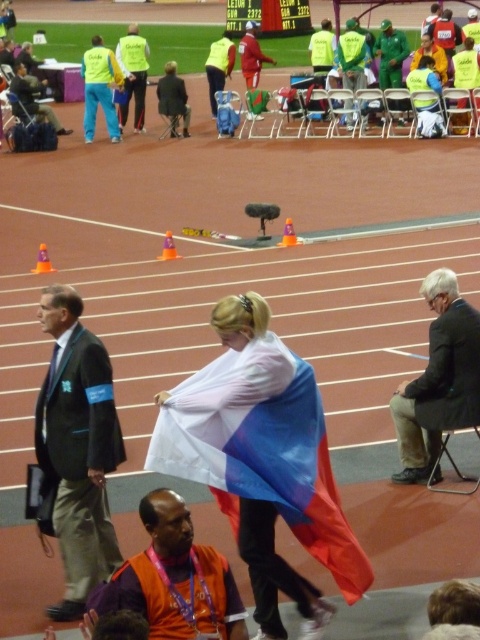
Question: Which of the following is the farthest from the observer?

Choices:
 (A) click(432, 378)
 (B) click(46, 289)
 (C) click(137, 76)
 (D) click(406, 100)

Answer: (C)

Question: Can you confirm if dark green suit at center is positioned above green fabric jacket at center?

Choices:
 (A) yes
 (B) no

Answer: (B)

Question: Does orange fabric at lower center have a lesser width compared to green fabric jacket at center?

Choices:
 (A) no
 (B) yes

Answer: (A)

Question: Among these objects, which one is farthest from the camera?

Choices:
 (A) dark gray suit at center
 (B) yellow reflective vest at upper center
 (C) green fabric jacket at center
 (D) green fabric suit at center

Answer: (B)

Question: Does dark gray suit at center appear on the right side of green fabric jacket at center?

Choices:
 (A) yes
 (B) no

Answer: (B)

Question: Among these objects, which one is nearest to the camera?

Choices:
 (A) yellow reflective vest at upper center
 (B) polyester flag at center
 (C) green fabric jacket at center
 (D) dark gray suit at center

Answer: (B)